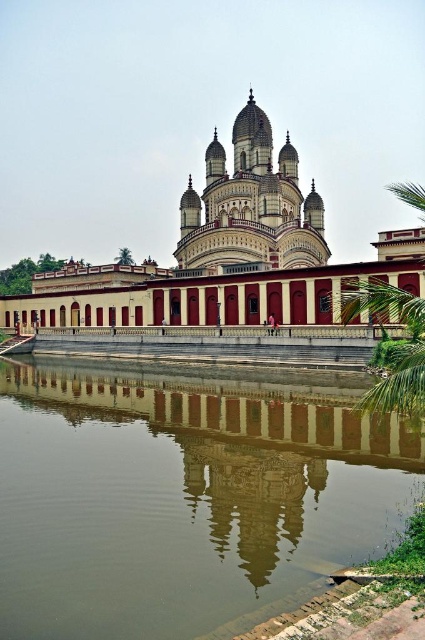
Question: Which is farther from the matte red building at center?

Choices:
 (A) brown concrete water at center
 (B) matte white temple at center

Answer: (A)

Question: Which point is closer to the camera taking this photo?

Choices:
 (A) (292, 172)
 (B) (238, 154)

Answer: (B)

Question: Does brown concrete water at center have a greater width compared to matte red building at center?

Choices:
 (A) no
 (B) yes

Answer: (A)

Question: Does matte red building at center have a greater width compared to matte white temple at center?

Choices:
 (A) no
 (B) yes

Answer: (B)

Question: Which point is farther to the camera?

Choices:
 (A) (246, 208)
 (B) (147, 273)

Answer: (B)

Question: Is brown concrete water at center bigger than matte red building at center?

Choices:
 (A) no
 (B) yes

Answer: (A)